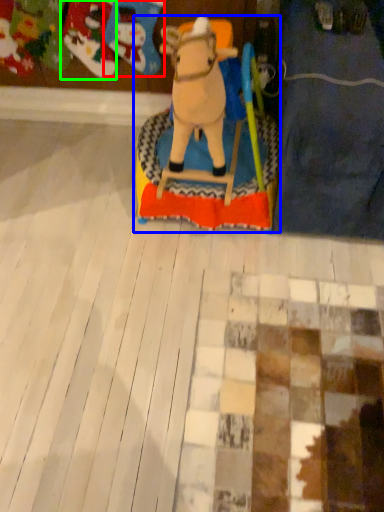
Question: Which object is positioned closest to toy (highlighted by a red box)? Select from toy (highlighted by a blue box) and toy (highlighted by a green box).

Choices:
 (A) toy
 (B) toy

Answer: (B)